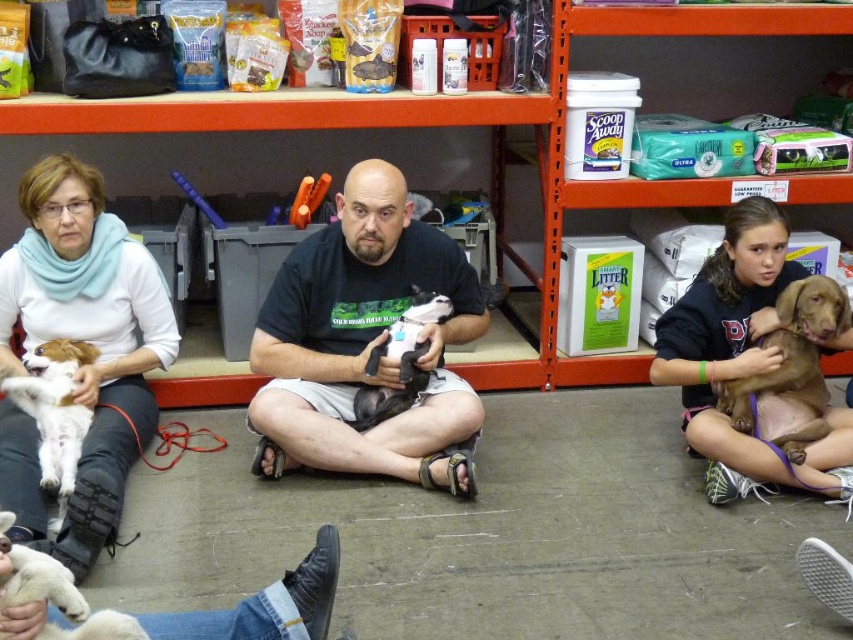
Measure the distance between brown furry dog at center right and black soft fabric dog at center.

brown furry dog at center right and black soft fabric dog at center are 3.49 feet apart.

Between brown furry dog at center right and black soft fabric dog at center, which one has less height?

black soft fabric dog at center

Between point (741, 392) and point (445, 304), which one is positioned behind?

Point (445, 304)

Locate an element on the screen. Image resolution: width=853 pixels, height=640 pixels. brown furry dog at center right is located at coordinates (791, 371).

Can you confirm if black cotton shirt at center is smaller than brown fur dog at right?

Actually, black cotton shirt at center might be larger than brown fur dog at right.

Does black cotton shirt at center have a lesser height compared to brown fur dog at right?

Incorrect, black cotton shirt at center's height does not fall short of brown fur dog at right's.

Locate an element on the screen. The image size is (853, 640). black cotton shirt at center is located at coordinates (364, 342).

Is point (657, 355) less distant than point (791, 300)?

No.

Does brown fur dog at right have a lesser height compared to brown furry dog at center right?

No.

Where is `brown fur dog at right`? brown fur dog at right is located at coordinates (741, 356).